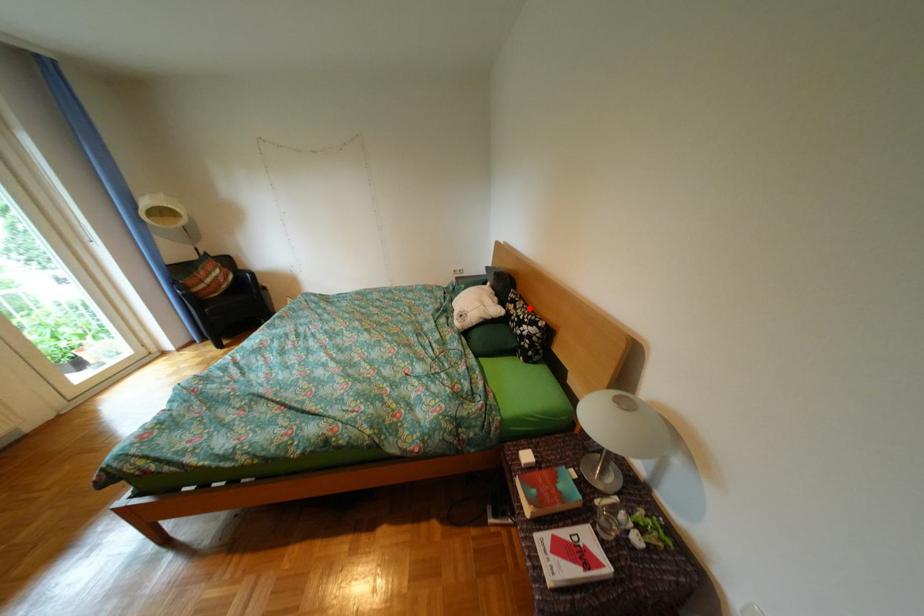
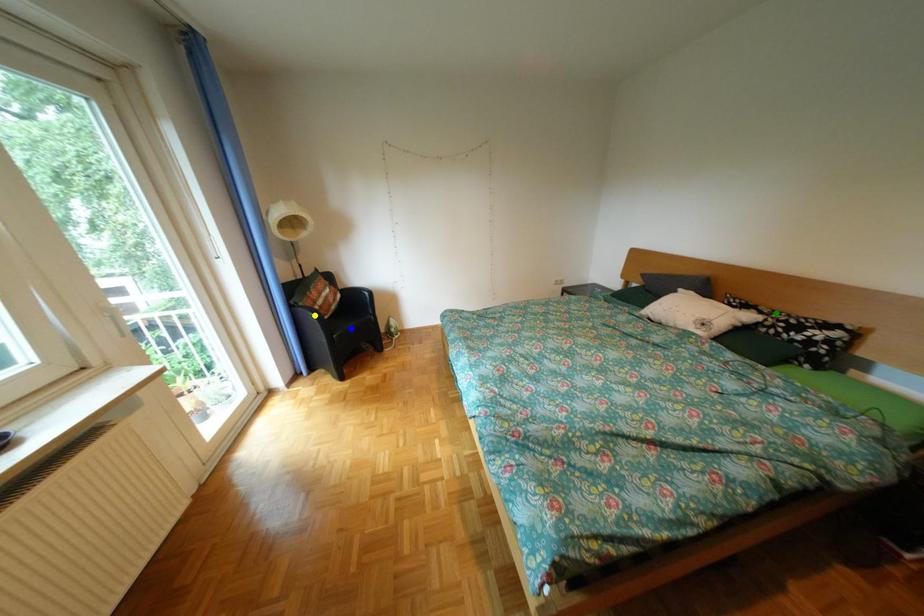
Question: I am providing you with two images of the same scene from different viewpoints. A red point is marked on the first image. You are given multiple points on the second image. In image 2, which mark is for the same physical point as the one in image 1?

Choices:
 (A) blue point
 (B) green point
 (C) yellow point

Answer: (B)